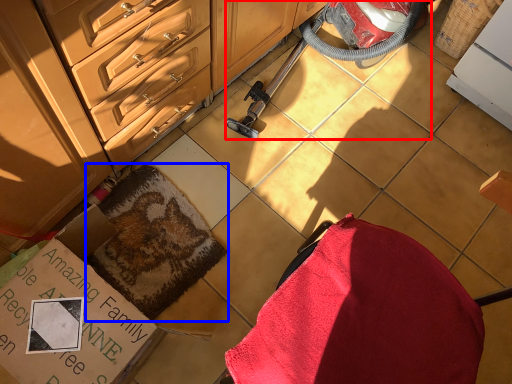
Question: Among these objects, which one is nearest to the camera, equipment (highlighted by a red box) or blanket (highlighted by a blue box)?

Choices:
 (A) equipment
 (B) blanket

Answer: (A)